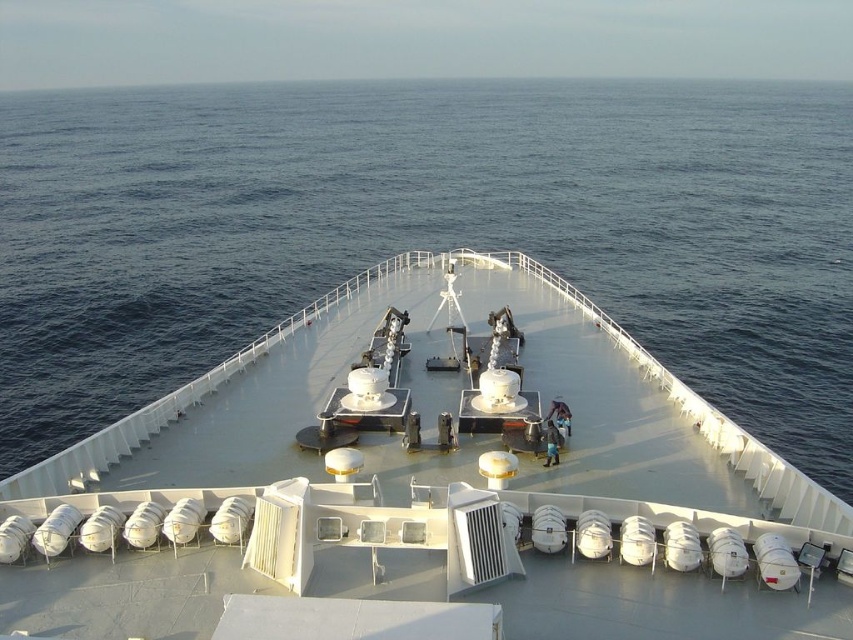
How distant is white matte boat at center from blue water at center?

A distance of 109.07 feet exists between white matte boat at center and blue water at center.

Based on the photo, which is above, white matte boat at center or blue water at center?

blue water at center is higher up.

Is point (392, 588) positioned in front of point (379, 209)?

Yes, it is.

Locate an element on the screen. The width and height of the screenshot is (853, 640). white matte boat at center is located at coordinates (426, 486).